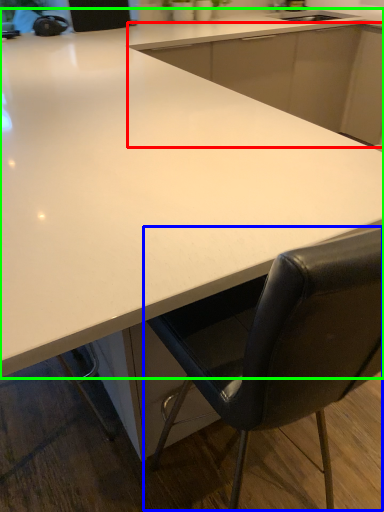
Question: Which object is positioned farthest from cabinetry (highlighted by a red box)? Select from chair (highlighted by a blue box) and countertop (highlighted by a green box).

Choices:
 (A) chair
 (B) countertop

Answer: (A)